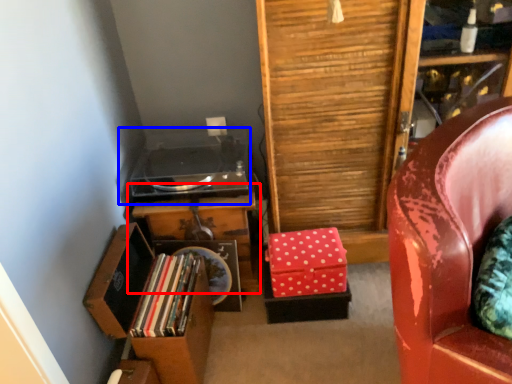
Question: Which object appears farthest to the camera in this image, table (highlighted by a red box) or stereo (highlighted by a blue box)?

Choices:
 (A) table
 (B) stereo

Answer: (A)